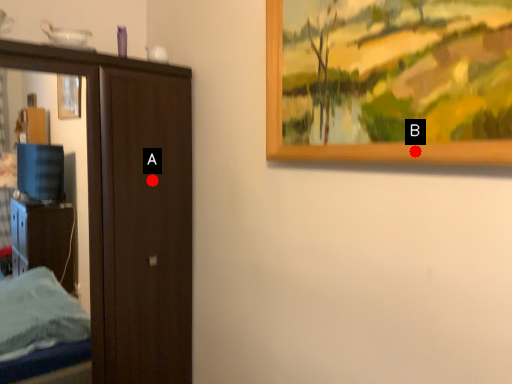
Question: Two points are circled on the image, labeled by A and B beside each circle. Which point is closer to the camera?

Choices:
 (A) A is closer
 (B) B is closer

Answer: (B)